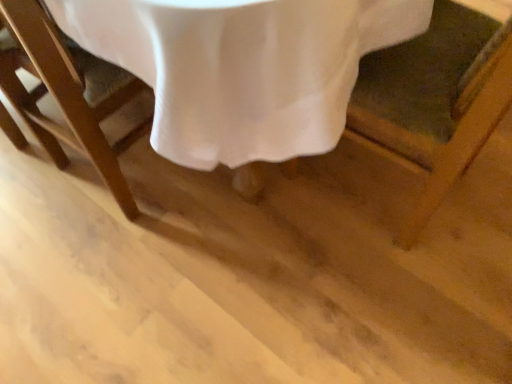
Locate an element on the screen. This screenshot has width=512, height=384. vacant space positioned to the left of wooden chair at lower right is located at coordinates (239, 231).